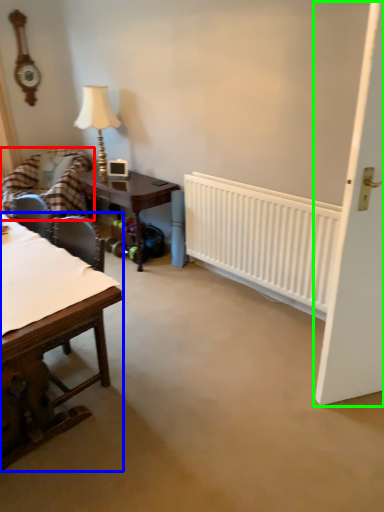
Question: Which is nearer to the chair (highlighted by a red box)? table (highlighted by a blue box) or door (highlighted by a green box).

Choices:
 (A) table
 (B) door

Answer: (A)